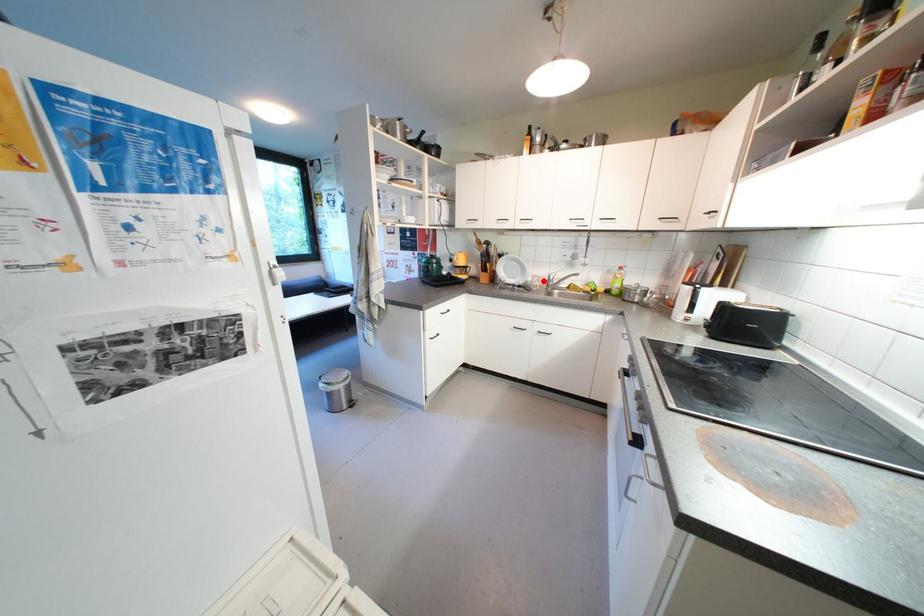
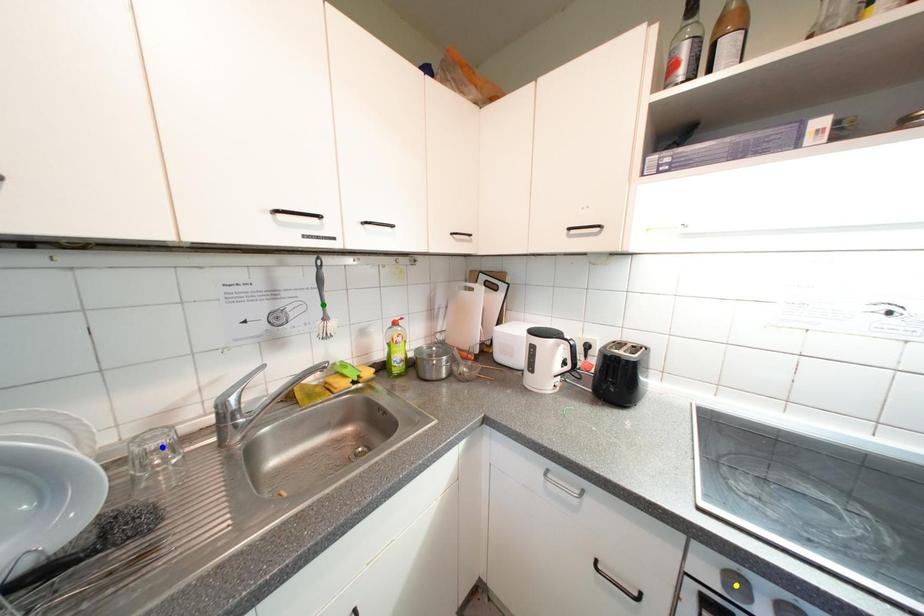
Question: I am providing you with two images of the same scene from different viewpoints. A red point is marked on the first image. You are given multiple points on the second image. In image 2, which mark is for the same physical point as the one in image 1?

Choices:
 (A) blue point
 (B) yellow point
 (C) green point

Answer: (A)